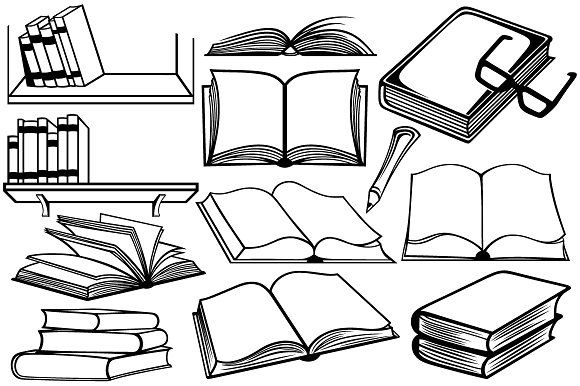
At what (x,y) coordinates should I click in order to perform the action: click on opened books. Please return your answer as a coordinate pair (x, y). The height and width of the screenshot is (386, 580). Looking at the image, I should click on (124, 252), (269, 225), (299, 315), (464, 214), (293, 126), (282, 40).